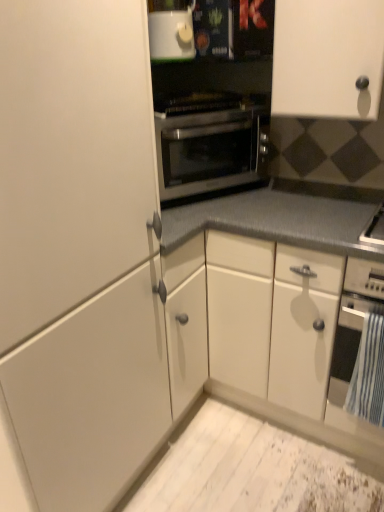
Identify the location of free space below white matte cabinet at upper right, which appears as the 2th cabinetry when viewed from the left (from a real-world perspective). The height and width of the screenshot is (512, 384). (318, 199).